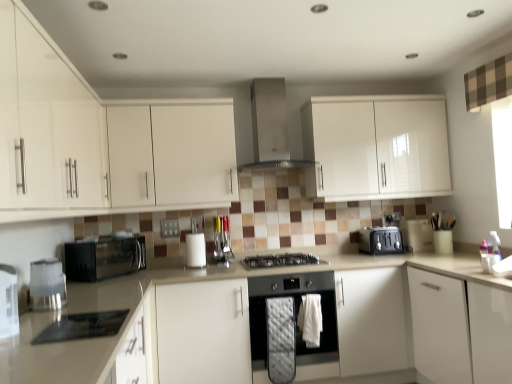
Question: From the image's perspective, does white matte cabinet at upper left, which appears as the fourth cabinetry when viewed from the right, appear higher than stainless steel oven at center, the 1th home appliance positioned from the bottom?

Choices:
 (A) no
 (B) yes

Answer: (B)

Question: Considering the relative sizes of white matte cabinet at upper left, the second cabinetry in the left-to-right sequence, and stainless steel oven at center, which appears as the 3th home appliance when viewed from the left, in the image provided, is white matte cabinet at upper left, the second cabinetry in the left-to-right sequence, taller than stainless steel oven at center, which appears as the 3th home appliance when viewed from the left,?

Choices:
 (A) no
 (B) yes

Answer: (B)

Question: Considering the relative sizes of white matte cabinet at upper left, the second cabinetry in the left-to-right sequence, and stainless steel oven at center, the third home appliance in the top-to-bottom sequence, in the image provided, is white matte cabinet at upper left, the second cabinetry in the left-to-right sequence, smaller than stainless steel oven at center, the third home appliance in the top-to-bottom sequence,?

Choices:
 (A) yes
 (B) no

Answer: (B)

Question: Is white matte cabinet at upper left, the second cabinetry in the left-to-right sequence, bigger than stainless steel oven at center, the 1th home appliance when ordered from right to left?

Choices:
 (A) no
 (B) yes

Answer: (B)

Question: Does white matte cabinet at upper left, which appears as the fourth cabinetry when viewed from the right, contain stainless steel oven at center, which appears as the 3th home appliance when viewed from the left?

Choices:
 (A) no
 (B) yes

Answer: (A)

Question: Is metallic silver utensil rack at center, which is the second appliance in back-to-front order, in front of or behind black glass cooktop at lower left, which appears as the second appliance when viewed from the left, in the image?

Choices:
 (A) front
 (B) behind

Answer: (B)

Question: Based on their positions, is metallic silver utensil rack at center, which appears as the 4th appliance when viewed from the left, located to the left or right of black glass cooktop at lower left, the first appliance positioned from the front?

Choices:
 (A) left
 (B) right

Answer: (B)

Question: Looking at their shapes, would you say metallic silver utensil rack at center, which is the second appliance in back-to-front order, is wider or thinner than black glass cooktop at lower left, acting as the 5th appliance starting from the back?

Choices:
 (A) wide
 (B) thin

Answer: (B)

Question: Would you say metallic silver utensil rack at center, the fourth appliance from the front, is inside or outside black glass cooktop at lower left, the first appliance positioned from the front?

Choices:
 (A) inside
 (B) outside

Answer: (B)

Question: Is white matte cabinet at upper left, the 3th cabinetry positioned from the right, inside or outside of metallic silver utensil rack at center, which appears as the 4th appliance when viewed from the left?

Choices:
 (A) inside
 (B) outside

Answer: (B)

Question: Considering their positions, is white matte cabinet at upper left, the 3th cabinetry positioned from the right, located in front of or behind metallic silver utensil rack at center, which is the second appliance in back-to-front order?

Choices:
 (A) front
 (B) behind

Answer: (A)

Question: From their relative heights in the image, would you say white matte cabinet at upper left, marked as the 3th cabinetry in a left-to-right arrangement, is taller or shorter than metallic silver utensil rack at center, the fourth appliance from the front?

Choices:
 (A) short
 (B) tall

Answer: (B)

Question: From a real-world perspective, is white matte cabinet at upper left, the 3th cabinetry positioned from the right, positioned above or below metallic silver utensil rack at center, which appears as the 4th appliance when viewed from the left?

Choices:
 (A) below
 (B) above

Answer: (B)

Question: In terms of width, does stainless steel range hood at upper center, which is counted as the first home appliance, starting from the top, look wider or thinner when compared to white glossy countertop at center?

Choices:
 (A) thin
 (B) wide

Answer: (A)

Question: From a real-world perspective, is stainless steel range hood at upper center, which is counted as the first home appliance, starting from the top, physically located above or below white glossy countertop at center?

Choices:
 (A) below
 (B) above

Answer: (B)